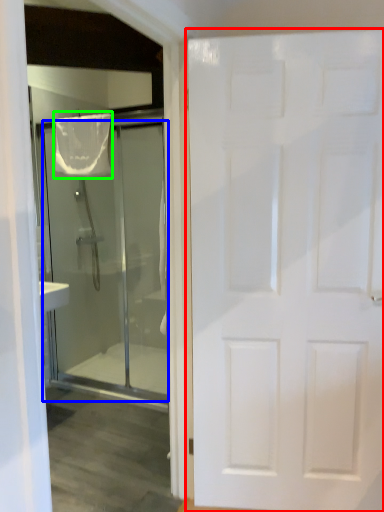
Question: Considering the real-world distances, which object is farthest from door (highlighted by a red box)? door (highlighted by a blue box) or shower curtain (highlighted by a green box)?

Choices:
 (A) door
 (B) shower curtain

Answer: (A)